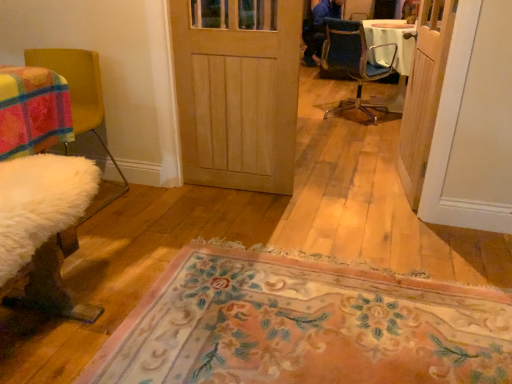
The width and height of the screenshot is (512, 384). Find the location of `vacant space situated on the left part of natural wood door at center, which appears as the second door when viewed from the right`. vacant space situated on the left part of natural wood door at center, which appears as the second door when viewed from the right is located at coordinates (169, 199).